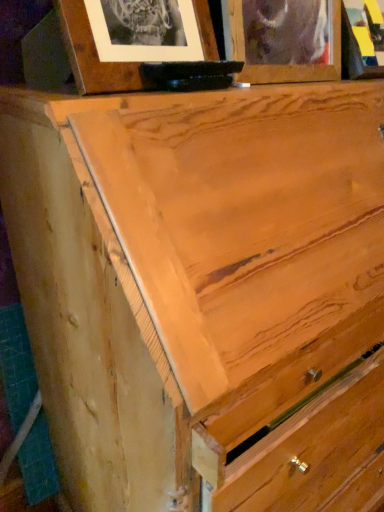
Locate an element on the screen. The width and height of the screenshot is (384, 512). wooden picture frame at upper center is located at coordinates [x=284, y=39].

What is the approximate width of wooden picture frame at upper center?

It is 3.38 inches.

What do you see at coordinates (284, 39) in the screenshot?
I see `wooden picture frame at upper center` at bounding box center [284, 39].

The image size is (384, 512). I want to click on wooden picture frame at upper center, so click(x=284, y=39).